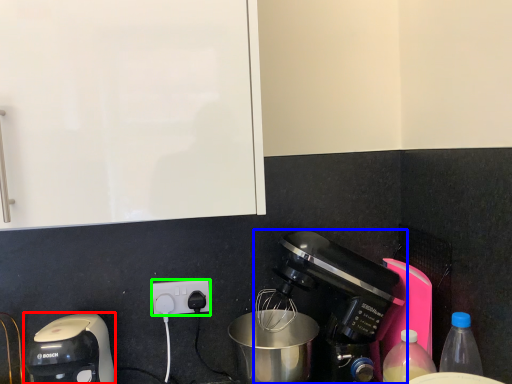
Question: Which object is positioned closest to coffee maker (highlighted by a red box)? Select from coffee maker (highlighted by a blue box) and power plugs and sockets (highlighted by a green box).

Choices:
 (A) coffee maker
 (B) power plugs and sockets

Answer: (B)